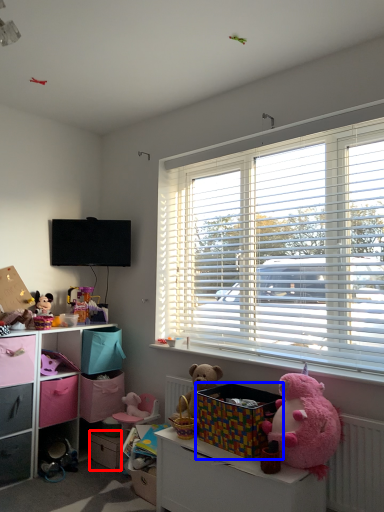
Question: Which point is further to the camera, drawer (highlighted by a red box) or storage box (highlighted by a blue box)?

Choices:
 (A) drawer
 (B) storage box

Answer: (A)